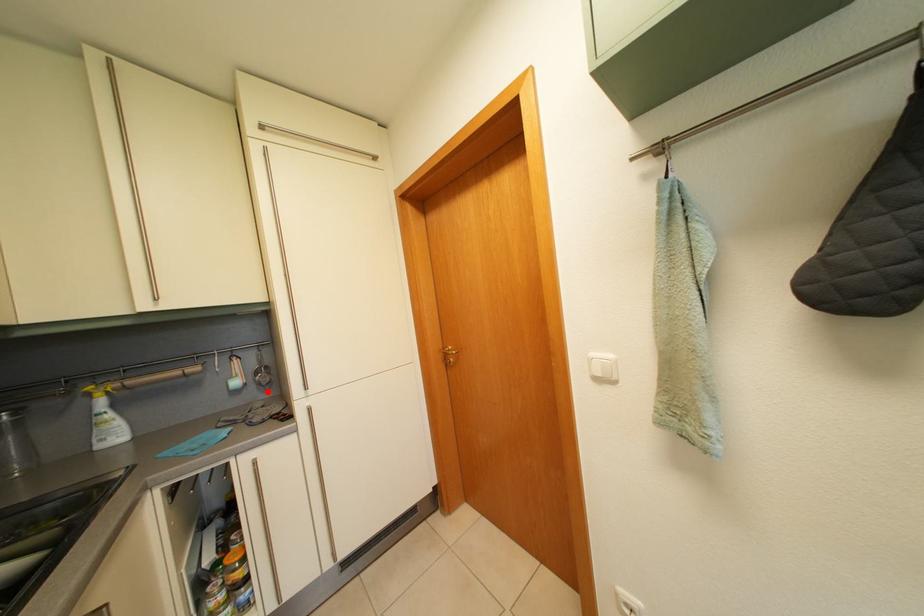
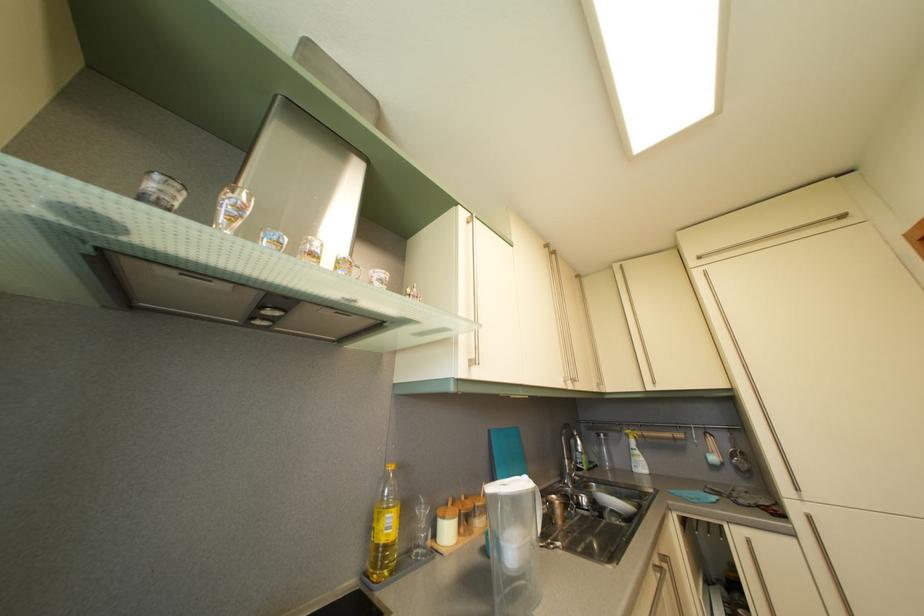
Locate, in the second image, the point that corresponds to the highlighted location in the first image.

(746, 476)